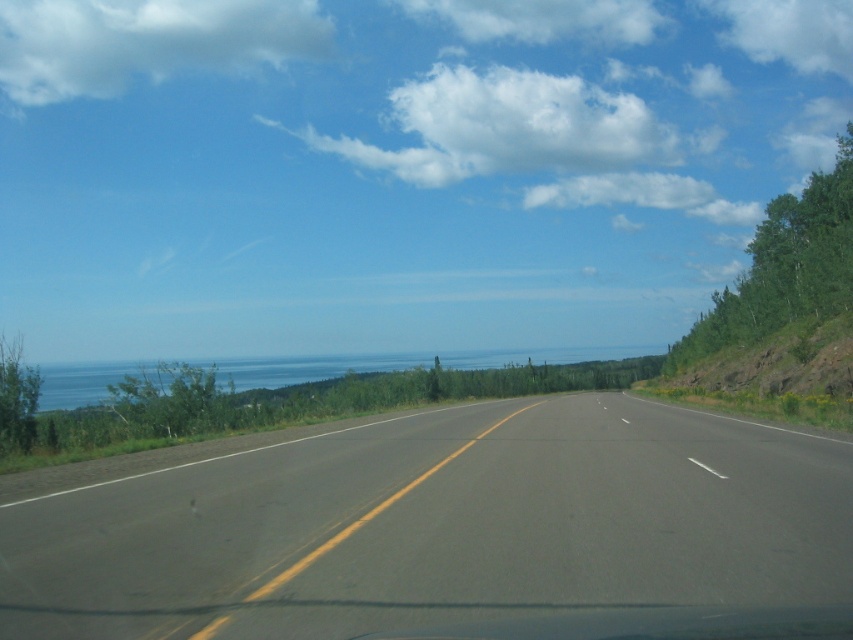
Question: Is asphalt road at center smaller than blue water at center?

Choices:
 (A) yes
 (B) no

Answer: (A)

Question: Is asphalt road at center further to camera compared to blue water at center?

Choices:
 (A) no
 (B) yes

Answer: (A)

Question: Which object appears closest to the camera in this image?

Choices:
 (A) asphalt road at center
 (B) blue water at center

Answer: (A)

Question: Can you confirm if asphalt road at center is bigger than blue water at center?

Choices:
 (A) no
 (B) yes

Answer: (A)

Question: Which of the following is the farthest from the observer?

Choices:
 (A) blue water at center
 (B) asphalt road at center

Answer: (A)